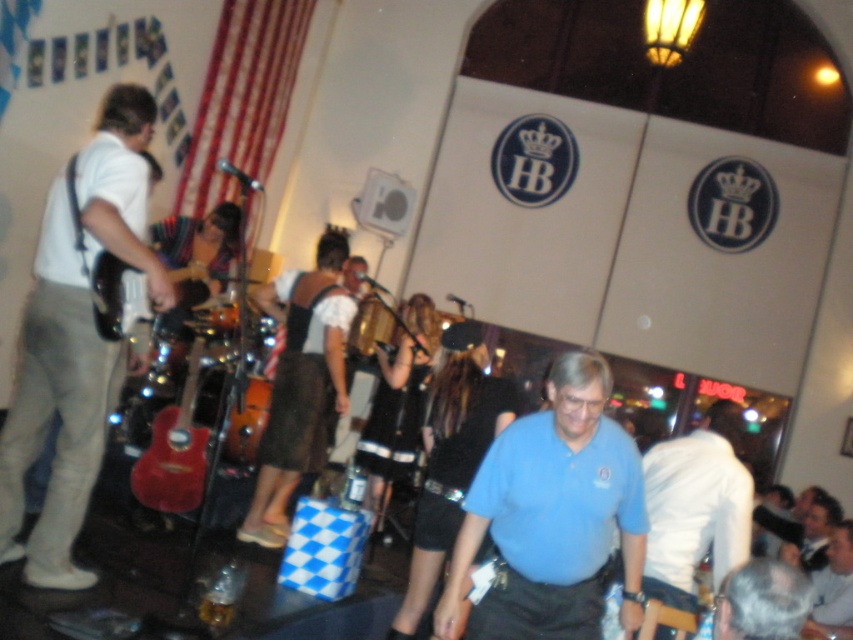
Question: Among these objects, which one is nearest to the camera?

Choices:
 (A) shiny red acoustic guitar at lower left
 (B) white matte guitar at left

Answer: (B)

Question: Which object appears closest to the camera in this image?

Choices:
 (A) blue cotton shirt at center
 (B) white matte guitar at left

Answer: (A)

Question: Does white matte guitar at left appear on the left side of white shirt at lower right?

Choices:
 (A) yes
 (B) no

Answer: (A)

Question: Does matte black electric guitar at left have a smaller size compared to white shirt at lower right?

Choices:
 (A) yes
 (B) no

Answer: (A)

Question: Which of the following is the closest to the observer?

Choices:
 (A) (109, 321)
 (B) (840, 529)
 (C) (778, 568)
 (D) (196, 472)

Answer: (C)

Question: Is matte black electric guitar at left further to camera compared to white shirt at lower right?

Choices:
 (A) yes
 (B) no

Answer: (B)